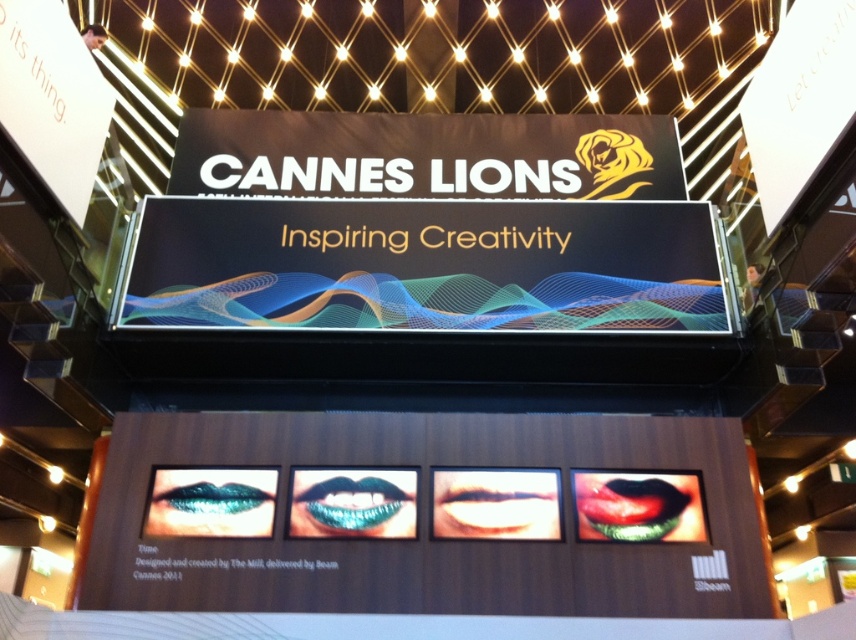
Question: Observing the image, what is the correct spatial positioning of shiny metallic mouth at center in reference to metallic blue lips at center?

Choices:
 (A) left
 (B) right

Answer: (B)

Question: Is the position of shiny red lips at center more distant than that of shiny metallic mouth at center?

Choices:
 (A) yes
 (B) no

Answer: (B)

Question: Does teal glossy lips at center have a larger size compared to shiny red lips at center?

Choices:
 (A) yes
 (B) no

Answer: (A)

Question: Which object is the farthest from the shiny metallic mouth at center?

Choices:
 (A) metallic lips at center
 (B) teal glossy lips at center

Answer: (A)

Question: Considering the real-world distances, which object is farthest from the shiny metallic mouth at center?

Choices:
 (A) metallic blue lips at center
 (B) teal glossy lips at center

Answer: (A)

Question: Which point is closer to the camera?

Choices:
 (A) (197, 502)
 (B) (550, 493)
 (C) (657, 483)

Answer: (A)